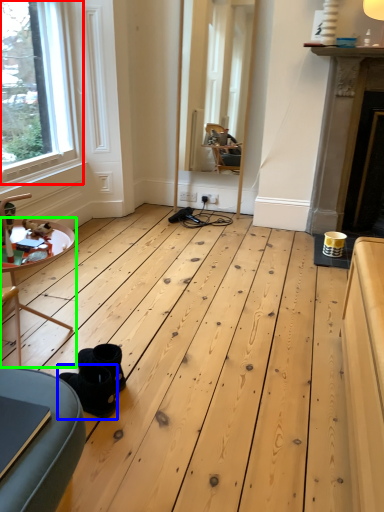
Question: Which object is the farthest from window (highlighted by a red box)? Choose among these: footwear (highlighted by a blue box) or table (highlighted by a green box).

Choices:
 (A) footwear
 (B) table

Answer: (A)